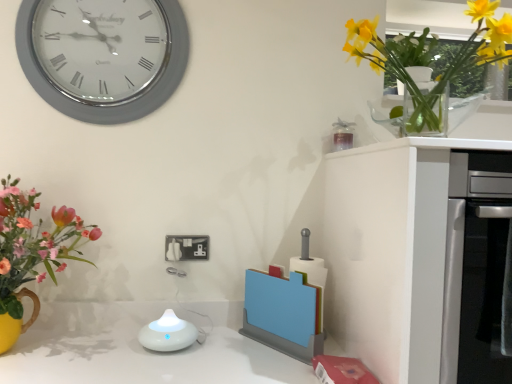
What do you see at coordinates (186, 248) in the screenshot? Image resolution: width=512 pixels, height=384 pixels. I see `white plastic electrical outlet at center` at bounding box center [186, 248].

I want to click on white glossy diffuser at center, so (168, 333).

Where is `white matte cabinet at right`? The image size is (512, 384). white matte cabinet at right is located at coordinates (419, 256).

From the image's perspective, which object appears higher, white glossy diffuser at center or silver metallic clock at upper left?

silver metallic clock at upper left appears higher in the image.

Does white glossy diffuser at center have a greater height compared to silver metallic clock at upper left?

In fact, white glossy diffuser at center may be shorter than silver metallic clock at upper left.

Considering the relative positions of white glossy diffuser at center and silver metallic clock at upper left in the image provided, is white glossy diffuser at center to the left of silver metallic clock at upper left from the viewer's perspective?

No.

Considering the points (154, 323) and (110, 80), which point is behind, point (154, 323) or point (110, 80)?

The point (110, 80) is farther.

From a real-world perspective, between yellow glass vase at upper right and silver metallic clock at upper left, who is vertically higher?

silver metallic clock at upper left, from a real-world perspective.

Can you tell me how much yellow glass vase at upper right and silver metallic clock at upper left differ in facing direction?

The facing directions of yellow glass vase at upper right and silver metallic clock at upper left are 0.252 degrees apart.

In the image, there is a silver metallic clock at upper left. Where is `floral arrangement below it (from the image's perspective)`? The image size is (512, 384). floral arrangement below it (from the image's perspective) is located at coordinates (431, 59).

Is the depth of yellow glass vase at upper right greater than that of silver metallic clock at upper left?

No, yellow glass vase at upper right is closer to the viewer.

Which is more to the right, silver metallic clock at upper left or yellow glass vase at upper right?

yellow glass vase at upper right is more to the right.

Is point (106, 44) behind point (486, 19)?

Yes, point (106, 44) is behind point (486, 19).

Could you tell me if silver metallic clock at upper left is turned towards yellow glass vase at upper right?

No, silver metallic clock at upper left is not turned towards yellow glass vase at upper right.

Is the depth of silver metallic clock at upper left greater than that of yellow glass vase at upper right?

That is True.

Are white glossy diffuser at center and white matte cabinet at right beside each other?

No, white glossy diffuser at center is not beside white matte cabinet at right.

Which is in front, point (163, 349) or point (386, 263)?

Positioned in front is point (386, 263).

Could you tell me if white glossy diffuser at center is turned towards white matte cabinet at right?

No, white glossy diffuser at center is not oriented towards white matte cabinet at right.

This screenshot has height=384, width=512. Identify the location of cabinetry on the right of the white glossy diffuser at center. (419, 256).

Could white glossy diffuser at center be considered to be inside silver metallic clock at upper left?

No.

Where is `appliance on the right of silver metallic clock at upper left`? appliance on the right of silver metallic clock at upper left is located at coordinates (168, 333).

Measure the distance from silver metallic clock at upper left to white glossy diffuser at center.

82.35 centimeters.

From a real-world perspective, is silver metallic clock at upper left on white glossy diffuser at center?

Indeed, from a real-world perspective, silver metallic clock at upper left stands above white glossy diffuser at center.

Is point (174, 253) less distant than point (167, 344)?

No, it is not.

Between white plastic electrical outlet at center and white glossy diffuser at center, which one has larger size?

Bigger between the two is white glossy diffuser at center.

In terms of height, does white plastic electrical outlet at center look taller or shorter compared to white glossy diffuser at center?

In the image, white plastic electrical outlet at center appears to be shorter than white glossy diffuser at center.

Are yellow glass vase at upper right and white glossy diffuser at center located far from each other?

No.

Is the position of yellow glass vase at upper right less distant than that of white glossy diffuser at center?

Yes, yellow glass vase at upper right is in front of white glossy diffuser at center.

Is yellow glass vase at upper right not inside white glossy diffuser at center?

yellow glass vase at upper right is positioned outside white glossy diffuser at center.

From a real-world perspective, is yellow glass vase at upper right positioned above or below white glossy diffuser at center?

Clearly, from a real-world perspective, yellow glass vase at upper right is above white glossy diffuser at center.

You are a GUI agent. You are given a task and a screenshot of the screen. Output one action in this format:
    pyautogui.click(x=<x>, y=<y>)
    Task: Click on the appliance that is on the right side of silver metallic clock at upper left
    The image size is (512, 384).
    Given the screenshot: What is the action you would take?
    pyautogui.click(x=168, y=333)

You are a GUI agent. You are given a task and a screenshot of the screen. Output one action in this format:
    pyautogui.click(x=<x>, y=<y>)
    Task: Click on the floral arrangement below the silver metallic clock at upper left (from a real-world perspective)
    The width and height of the screenshot is (512, 384).
    Given the screenshot: What is the action you would take?
    tap(431, 59)

Estimate the real-world distances between objects in this image. Which object is further from white glossy diffuser at center, white matte cabinet at right or white plastic electrical outlet at center?

white matte cabinet at right is further to white glossy diffuser at center.

From the image, which object appears to be nearer to white glossy diffuser at center, yellow glass vase at upper right or white matte cabinet at right?

white matte cabinet at right lies closer to white glossy diffuser at center than the other object.

From the image, which object appears to be farther from white glossy diffuser at center, silver metallic clock at upper left or white matte cabinet at right?

Based on the image, silver metallic clock at upper left appears to be further to white glossy diffuser at center.

Based on their spatial positions, is white glossy diffuser at center or yellow glass vase at upper right closer to silver metallic clock at upper left?

Based on the image, yellow glass vase at upper right appears to be nearer to silver metallic clock at upper left.

When comparing their distances from white glossy diffuser at center, does silver metallic clock at upper left or white plastic electrical outlet at center seem further?

silver metallic clock at upper left is positioned further to the anchor white glossy diffuser at center.

Based on the photo, estimate the real-world distances between objects in this image. Which object is closer to white matte cabinet at right, white glossy diffuser at center or yellow glass vase at upper right?

Among the two, yellow glass vase at upper right is located nearer to white matte cabinet at right.

Which object lies nearer to the anchor point white plastic electrical outlet at center, white glossy diffuser at center or white matte cabinet at right?

white glossy diffuser at center.

Which object lies further to the anchor point white matte cabinet at right, white glossy diffuser at center or silver metallic clock at upper left?

Among the two, silver metallic clock at upper left is located further to white matte cabinet at right.

Locate an element on the screen. The width and height of the screenshot is (512, 384). floral arrangement located between silver metallic clock at upper left and white matte cabinet at right in the left-right direction is located at coordinates (431, 59).

Find the location of a particular element. The height and width of the screenshot is (384, 512). appliance located between silver metallic clock at upper left and white matte cabinet at right in the left-right direction is located at coordinates click(x=168, y=333).

You are a GUI agent. You are given a task and a screenshot of the screen. Output one action in this format:
    pyautogui.click(x=<x>, y=<y>)
    Task: Click on the electric outlet situated between white glossy diffuser at center and yellow glass vase at upper right from left to right
    The width and height of the screenshot is (512, 384).
    Given the screenshot: What is the action you would take?
    pyautogui.click(x=186, y=248)

The width and height of the screenshot is (512, 384). What are the coordinates of `electric outlet located between silver metallic clock at upper left and yellow glass vase at upper right in the left-right direction` in the screenshot? It's located at (186, 248).